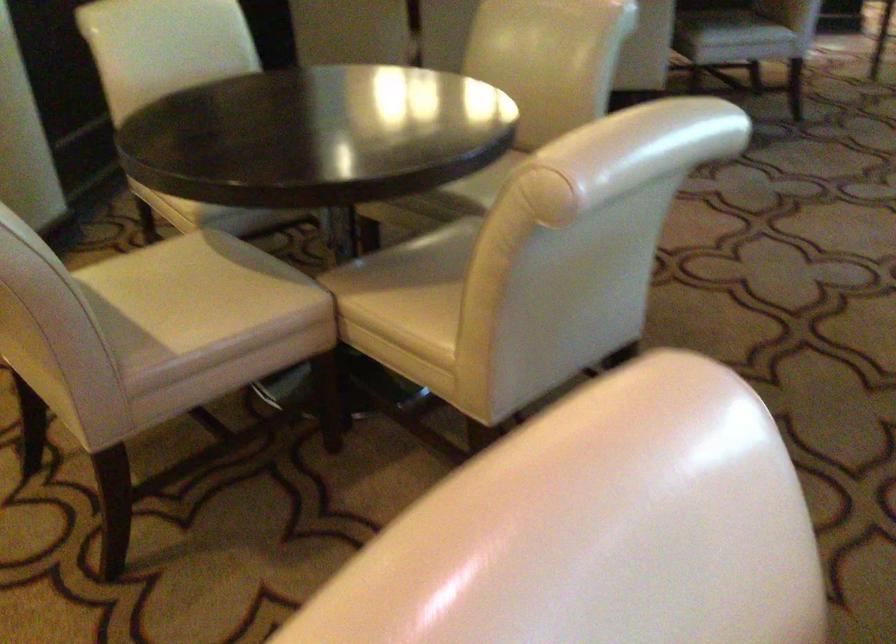
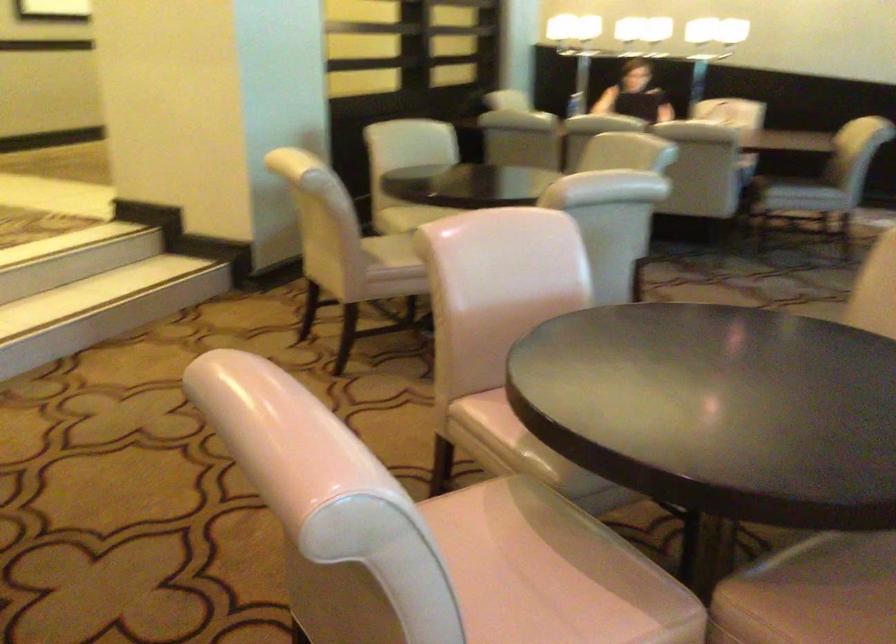
Find the pixel in the second image that matches (x=167, y=301) in the first image.

(391, 252)